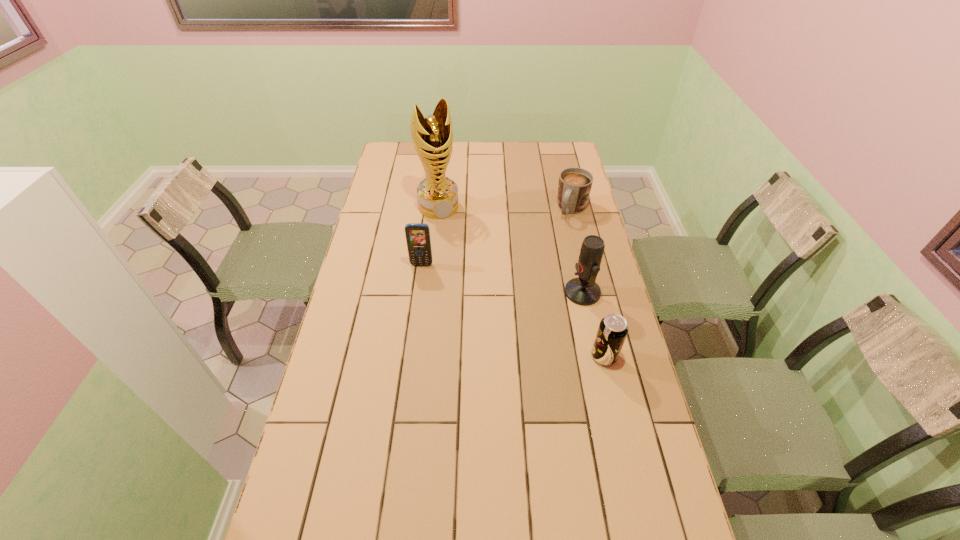
You are a GUI agent. You are given a task and a screenshot of the screen. Output one action in this format:
    pyautogui.click(x=<x>, y=<y>)
    Task: Click on the free spot between the fourth shortest object and the tallest object
    The width and height of the screenshot is (960, 540).
    Given the screenshot: What is the action you would take?
    pyautogui.click(x=511, y=249)

I want to click on empty space that is in between the tallest object and the soda can, so click(x=521, y=281).

The image size is (960, 540). What are the coordinates of `vacant space in between the mug and the third farthest object` in the screenshot? It's located at (497, 237).

Identify the location of empty location between the fourth shortest object and the mug. Image resolution: width=960 pixels, height=540 pixels. (577, 251).

Locate an element on the screen. empty space between the mug and the award is located at coordinates (505, 208).

Where is `object that stands as the fourth closest to the mug`? This screenshot has height=540, width=960. object that stands as the fourth closest to the mug is located at coordinates point(612,331).

Select which object is the closest to the soda can. Please provide its 2D coordinates. Your answer should be formatted as a tuple, i.e. [(x, y)], where the tuple contains the x and y coordinates of a point satisfying the conditions above.

[(583, 290)]

The image size is (960, 540). What are the coordinates of `free space that satisfies the following two spatial constraints: 1. on the front side of the tallest object; 2. on the left side of the nearest object` in the screenshot? It's located at (422, 356).

At what (x,y) coordinates should I click in order to perform the action: click on free space that satisfies the following two spatial constraints: 1. on the screen of the third nearest object; 2. on the right side of the nearest object. Please return your answer as a coordinate pair (x, y). Looking at the image, I should click on (410, 356).

This screenshot has width=960, height=540. In order to click on blank space that satisfies the following two spatial constraints: 1. on the front side of the mug; 2. on the right side of the tallest object in this screenshot , I will do pyautogui.click(x=439, y=210).